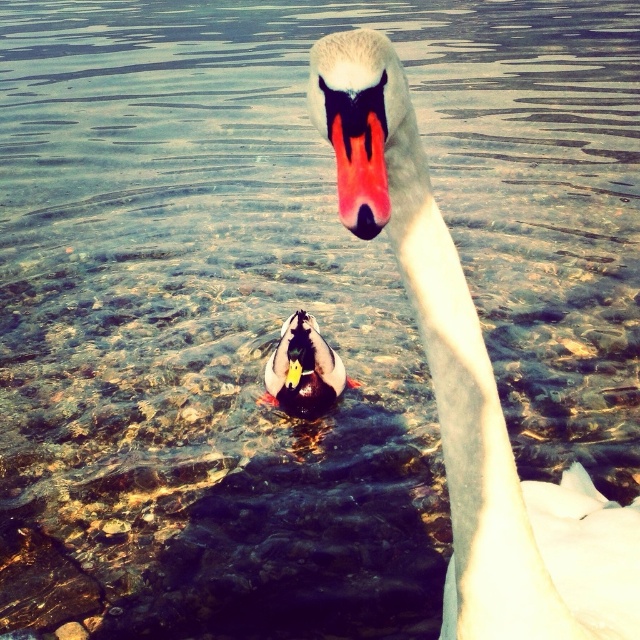
Question: Is white glossy swan at upper center smaller than matte black beak at center?

Choices:
 (A) no
 (B) yes

Answer: (A)

Question: Is white glossy swan at upper center thinner than matte black beak at center?

Choices:
 (A) no
 (B) yes

Answer: (A)

Question: Where is white glossy swan at upper center located in relation to shiny multicolored duck at center in the image?

Choices:
 (A) left
 (B) right

Answer: (B)

Question: Which object is the farthest from the white glossy swan at upper center?

Choices:
 (A) shiny multicolored duck at center
 (B) matte black beak at center

Answer: (A)

Question: Based on their relative distances, which object is nearer to the matte black beak at center?

Choices:
 (A) shiny multicolored duck at center
 (B) white glossy swan at upper center

Answer: (B)

Question: Which of the following is the closest to the observer?

Choices:
 (A) matte black beak at center
 (B) shiny multicolored duck at center
 (C) white glossy swan at upper center

Answer: (A)